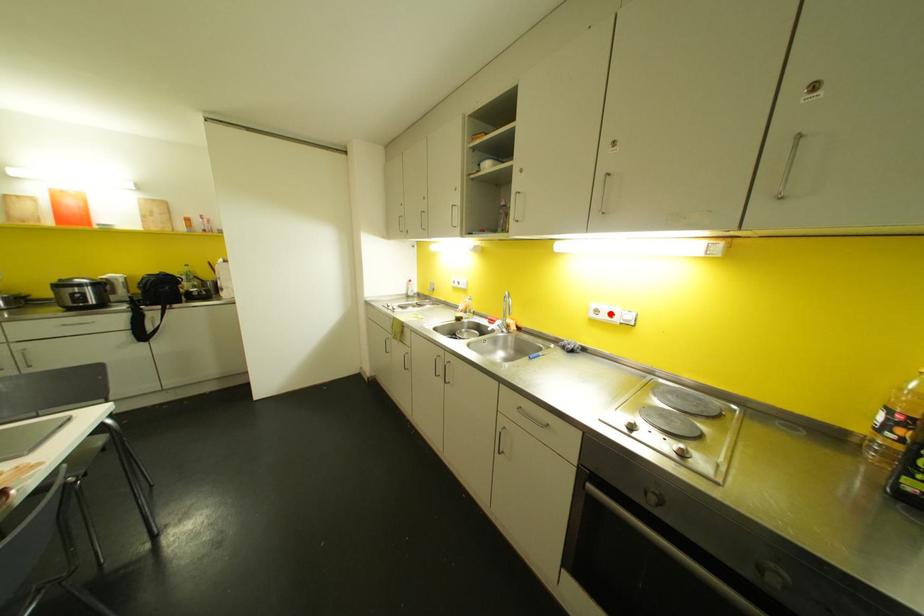
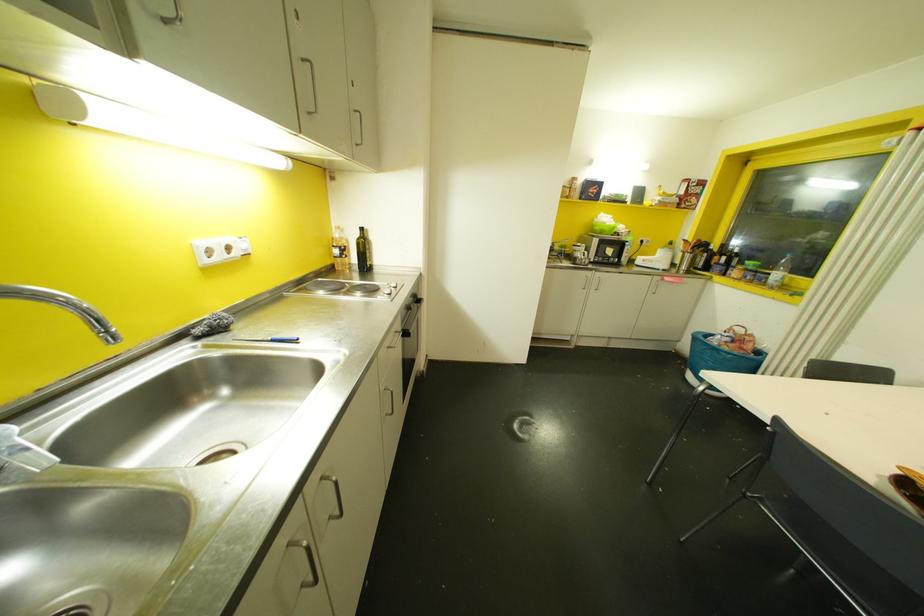
The point at the highlighted location is marked in the first image. Where is the corresponding point in the second image?

(227, 248)